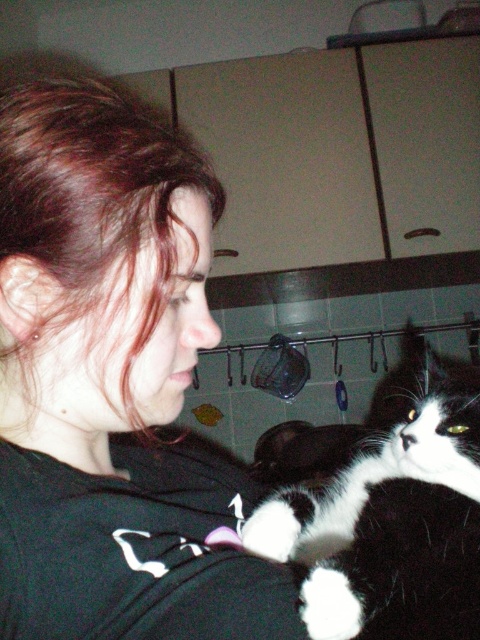
Is black and white fur at lower right to the right of white fur paw at shoulder from the viewer's perspective?

Indeed, black and white fur at lower right is positioned on the right side of white fur paw at shoulder.

Is point (389, 588) positioned after point (348, 588)?

Yes, it is.

Identify the location of black and white fur at lower right. This screenshot has height=640, width=480. (392, 518).

Between black matte shirt at center and white fur paw at shoulder, which one is positioned lower?

Positioned lower is white fur paw at shoulder.

The height and width of the screenshot is (640, 480). Describe the element at coordinates (112, 381) in the screenshot. I see `black matte shirt at center` at that location.

You are a GUI agent. You are given a task and a screenshot of the screen. Output one action in this format:
    pyautogui.click(x=<x>, y=<y>)
    Task: Click on the black matte shirt at center
    
    Given the screenshot: What is the action you would take?
    pyautogui.click(x=112, y=381)

Who is shorter, black matte shirt at center or black and white fur at lower right?

black and white fur at lower right is shorter.

Does black matte shirt at center appear on the right side of black and white fur at lower right?

No, black matte shirt at center is not to the right of black and white fur at lower right.

You are a GUI agent. You are given a task and a screenshot of the screen. Output one action in this format:
    pyautogui.click(x=<x>, y=<y>)
    Task: Click on the black matte shirt at center
    This screenshot has width=480, height=640.
    Given the screenshot: What is the action you would take?
    pyautogui.click(x=112, y=381)

At what (x,y) coordinates should I click in order to perform the action: click on black matte shirt at center. Please return your answer as a coordinate pair (x, y). The image size is (480, 640). Looking at the image, I should click on pos(112,381).